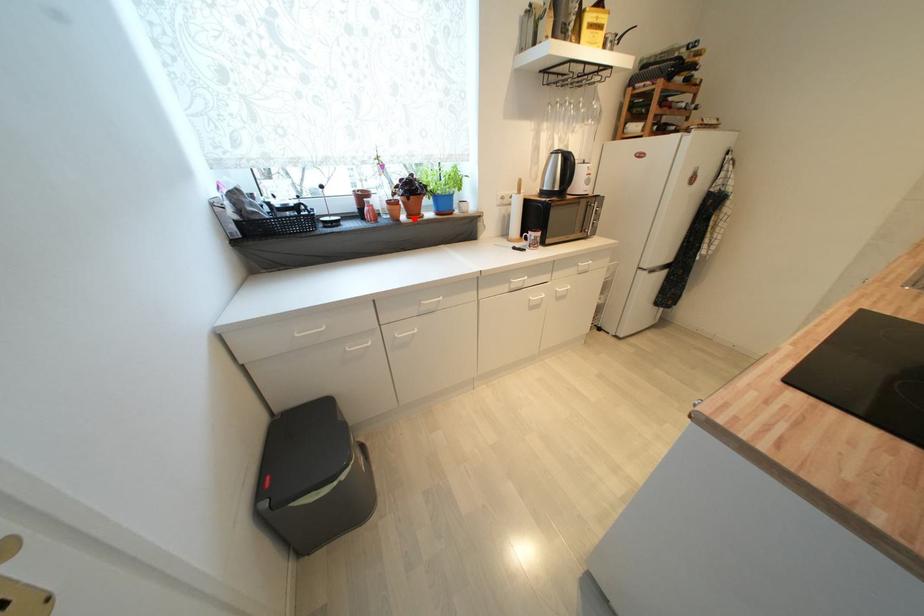
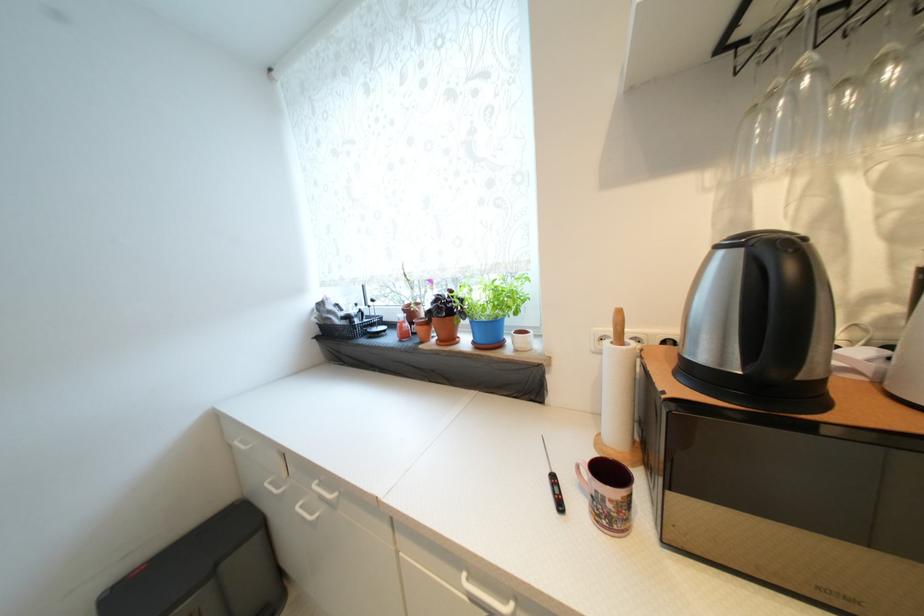
The point at the highlighted location is marked in the first image. Where is the corresponding point in the second image?

(445, 342)